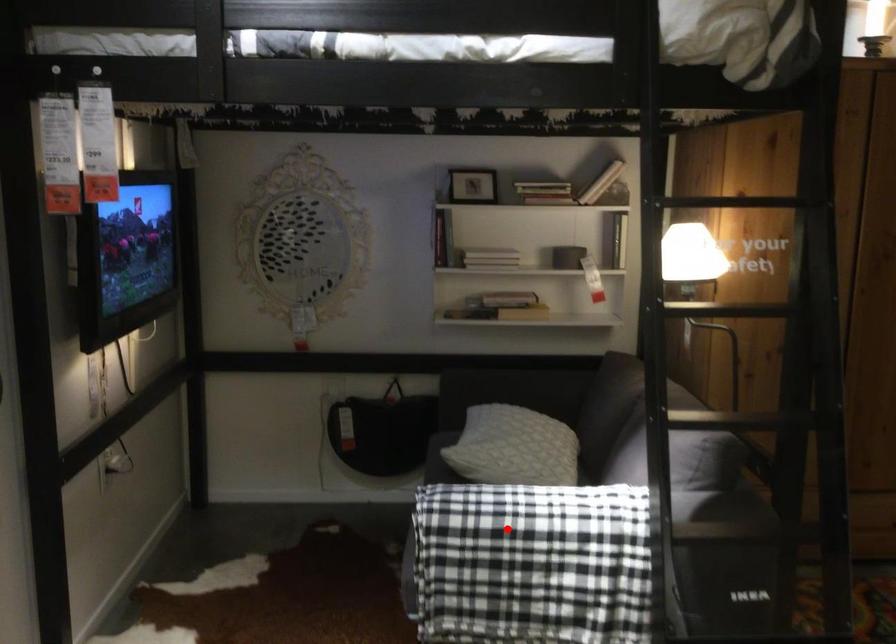
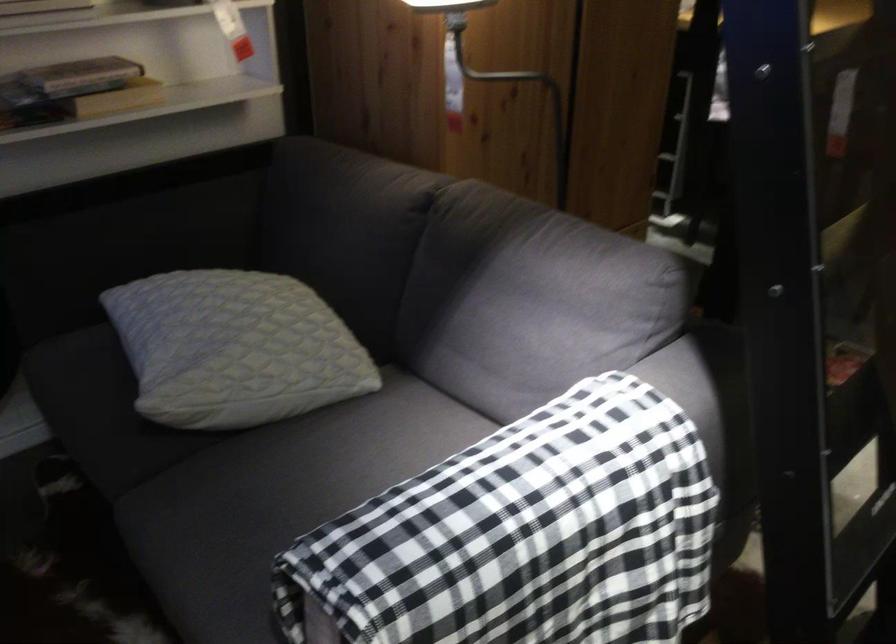
Question: I am providing you with two images of the same scene from different viewpoints. Image1 has a red point marked. In image2, the corresponding 3D location appears at what relative position? Reply with the corresponding letter.

Choices:
 (A) Closer
 (B) Farther

Answer: (A)